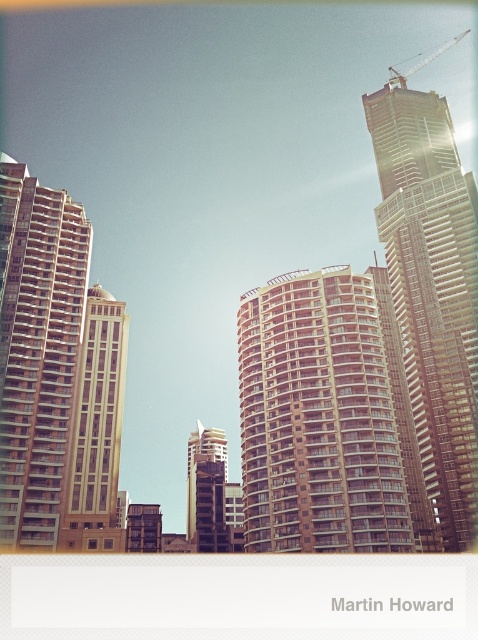
You are a city planner analyzing the urban layout. Considering the glassy steel skyscraper at upper right and the metallic glass tower at center, which one has a greater horizontal span when viewed from this perspective?

The glassy steel skyscraper at upper right has a greater horizontal span than the metallic glass tower at center because its width is larger according to the description.

You are a drone operator preparing to fly a drone from the matte glass tower at left to the metallic glass tower at center. Based on the scene, will the drone have an unobstructed path between the two towers?

The matte glass tower at left is in front of the metallic glass tower at center, so the drone will have an unobstructed path between the two towers.

You are a drone operator planning to fly a drone from the point marked at coordinates point (432, 291) to the nearest building. Which building should you fly towards?

The point marked at coordinates point (432, 291) is located on the glassy steel skyscraper at upper right, so you should fly towards the glassy steel skyscraper at upper right.